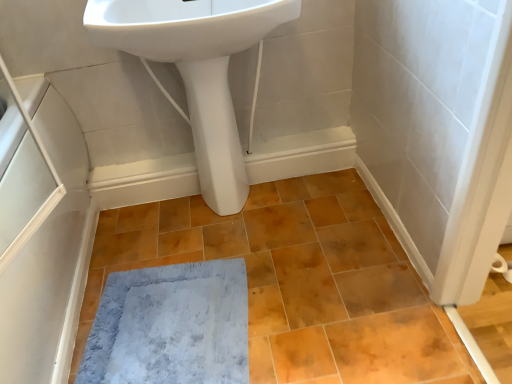
Question: Is matte orange ceramic tile at center thinner than white glossy pedestal at center?

Choices:
 (A) no
 (B) yes

Answer: (A)

Question: Is matte orange ceramic tile at center not inside white glossy pedestal at center?

Choices:
 (A) yes
 (B) no

Answer: (A)

Question: Could white glossy pedestal at center be considered to be inside matte orange ceramic tile at center?

Choices:
 (A) no
 (B) yes

Answer: (A)

Question: Could you tell me if matte orange ceramic tile at center is facing white glossy pedestal at center?

Choices:
 (A) yes
 (B) no

Answer: (B)

Question: From a real-world perspective, is matte orange ceramic tile at center below white glossy pedestal at center?

Choices:
 (A) yes
 (B) no

Answer: (A)

Question: Is point (167, 357) positioned closer to the camera than point (295, 254)?

Choices:
 (A) closer
 (B) farther

Answer: (A)

Question: Which is correct: gray plush bath mat at lower center is inside matte orange ceramic tile at center, or outside of it?

Choices:
 (A) inside
 (B) outside

Answer: (A)

Question: From a real-world perspective, is gray plush bath mat at lower center positioned above or below matte orange ceramic tile at center?

Choices:
 (A) below
 (B) above

Answer: (A)

Question: Is gray plush bath mat at lower center bigger or smaller than matte orange ceramic tile at center?

Choices:
 (A) small
 (B) big

Answer: (A)

Question: Is matte orange ceramic tile at center to the left or to the right of white glossy sink at upper center in the image?

Choices:
 (A) right
 (B) left

Answer: (A)

Question: From a real-world perspective, is matte orange ceramic tile at center above or below white glossy sink at upper center?

Choices:
 (A) below
 (B) above

Answer: (A)

Question: Choose the correct answer: Is matte orange ceramic tile at center inside white glossy sink at upper center or outside it?

Choices:
 (A) outside
 (B) inside

Answer: (A)

Question: Considering the positions of matte orange ceramic tile at center and white glossy sink at upper center in the image, is matte orange ceramic tile at center taller or shorter than white glossy sink at upper center?

Choices:
 (A) short
 (B) tall

Answer: (A)

Question: Is gray plush bath mat at lower center in front of or behind white glossy pedestal at center in the image?

Choices:
 (A) front
 (B) behind

Answer: (A)

Question: Considering the positions of point (142, 345) and point (203, 102), is point (142, 345) closer or farther from the camera than point (203, 102)?

Choices:
 (A) farther
 (B) closer

Answer: (B)